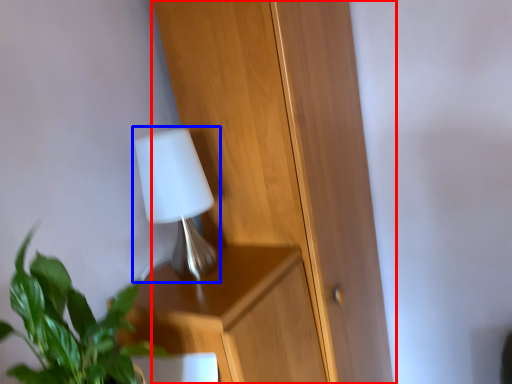
Question: Which object appears closest to the camera in this image, dresser (highlighted by a red box) or lamp (highlighted by a blue box)?

Choices:
 (A) dresser
 (B) lamp

Answer: (B)